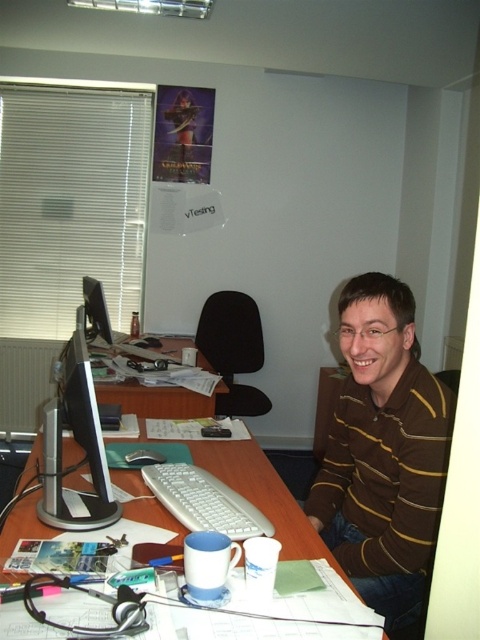
Question: Which is farther from the wooden desk at center?

Choices:
 (A) matte black monitor at left
 (B) brown striped shirt at center

Answer: (A)

Question: Which object is farther from the camera taking this photo?

Choices:
 (A) wooden desk at center
 (B) brown striped shirt at center
 (C) satin silver monitor at center
 (D) white plastic keyboard at center

Answer: (B)

Question: Which object is the farthest from the wooden desk at center?

Choices:
 (A) satin silver monitor at center
 (B) white plastic monitor at center
 (C) white plastic keyboard at center

Answer: (B)

Question: Does satin silver monitor at center have a greater width compared to matte black monitor at left?

Choices:
 (A) yes
 (B) no

Answer: (B)

Question: Is the position of satin silver monitor at center more distant than that of white plastic keyboard at center?

Choices:
 (A) no
 (B) yes

Answer: (A)

Question: Can you confirm if white plastic keyboard at center is positioned above matte black monitor at left?

Choices:
 (A) no
 (B) yes

Answer: (A)